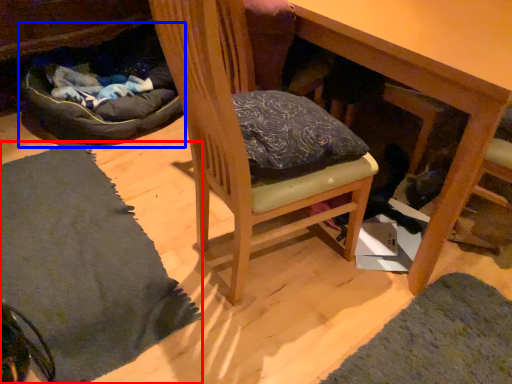
Question: Which object is further to the camera taking this photo, mat (highlighted by a red box) or bean bag chair (highlighted by a blue box)?

Choices:
 (A) mat
 (B) bean bag chair

Answer: (B)